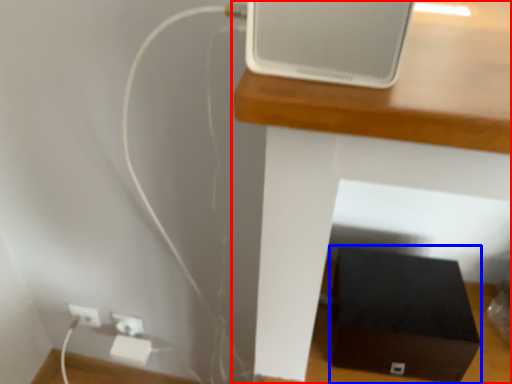
Question: Which object is further to the camera taking this photo, furniture (highlighted by a red box) or box (highlighted by a blue box)?

Choices:
 (A) furniture
 (B) box

Answer: (B)